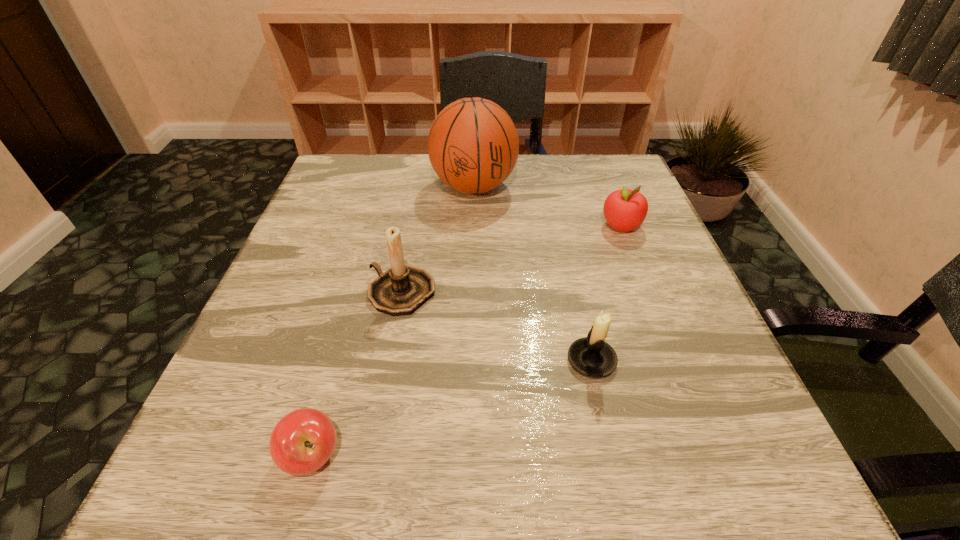
Where is `vacant region located on the front of the basketball`? vacant region located on the front of the basketball is located at coordinates [x=472, y=276].

What are the coordinates of `vacant area situated on the back of the taller candle holder` in the screenshot? It's located at (422, 177).

At what (x,y) coordinates should I click in order to perform the action: click on vacant point located on the back of the fourth farthest object. Please return your answer as a coordinate pair (x, y). This screenshot has width=960, height=540. Looking at the image, I should click on (571, 270).

Identify the location of free space located on the back of the taller apple. (599, 168).

Identify the location of vacant point located on the back of the shorter apple. The image size is (960, 540). (330, 391).

The width and height of the screenshot is (960, 540). I want to click on object situated at the far edge, so click(473, 145).

At what (x,y) coordinates should I click in order to perform the action: click on object present at the near edge. Please return your answer as a coordinate pair (x, y). Looking at the image, I should click on (302, 441).

What are the coordinates of `object that is positioned at the left edge` in the screenshot? It's located at (302, 441).

Locate an element on the screen. This screenshot has width=960, height=540. object located in the right edge section of the desktop is located at coordinates (625, 210).

The image size is (960, 540). I want to click on object that is at the near left corner, so click(302, 441).